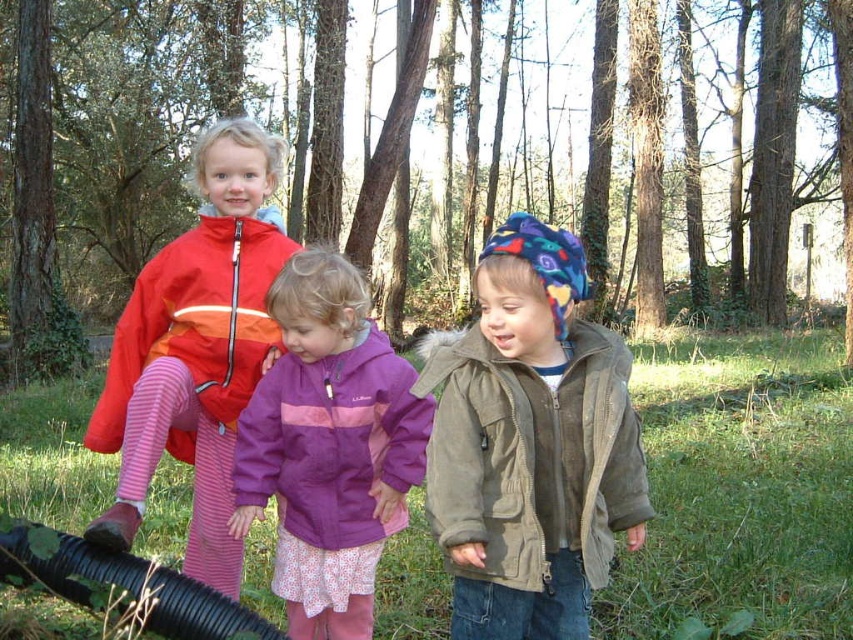
Question: Is matte red jacket at left further to the viewer compared to purple matte jacket at center?

Choices:
 (A) yes
 (B) no

Answer: (A)

Question: Which object is closer to the camera taking this photo?

Choices:
 (A) black rubber garden hose at lower left
 (B) suede jacket at center

Answer: (B)

Question: Among these objects, which one is farthest from the camera?

Choices:
 (A) black rubber garden hose at lower left
 (B) matte red jacket at left
 (C) purple matte jacket at center
 (D) suede jacket at center

Answer: (B)

Question: Estimate the real-world distances between objects in this image. Which object is closer to the black rubber garden hose at lower left?

Choices:
 (A) suede jacket at center
 (B) matte red jacket at left

Answer: (B)

Question: Does purple matte jacket at center appear on the right side of black rubber garden hose at lower left?

Choices:
 (A) yes
 (B) no

Answer: (A)

Question: Is purple matte jacket at center bigger than black rubber garden hose at lower left?

Choices:
 (A) yes
 (B) no

Answer: (A)